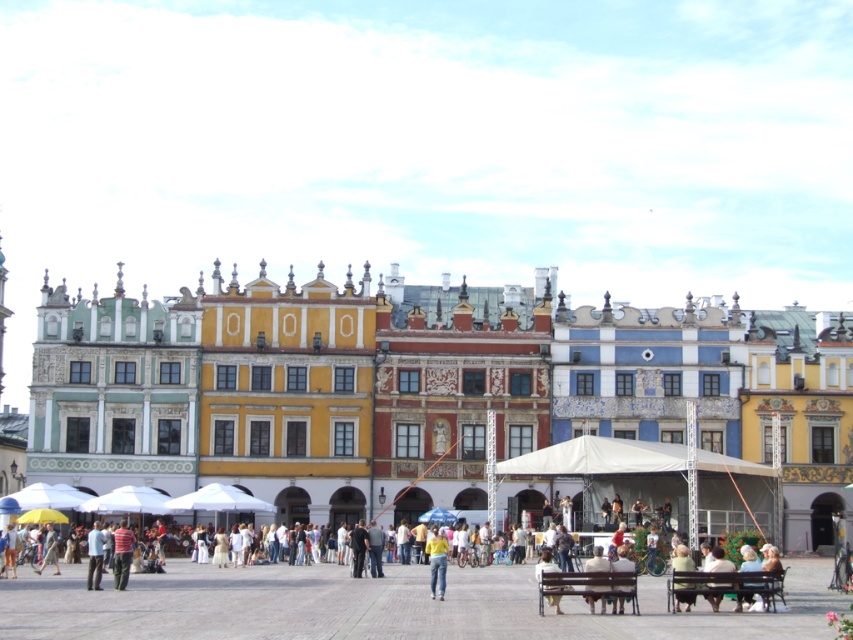
Question: Which of the following is the closest to the observer?

Choices:
 (A) white fabric canopy at center
 (B) white cotton shirt at lower center
 (C) multicolored painted buildings at center

Answer: (B)

Question: Which point is farther to the camera?

Choices:
 (A) (125, 564)
 (B) (782, 614)

Answer: (A)

Question: From the image, what is the correct spatial relationship of multicolored painted buildings at center in relation to striped shirt at lower left?

Choices:
 (A) right
 (B) left

Answer: (A)

Question: Which of the following is the closest to the observer?

Choices:
 (A) (123, 548)
 (B) (630, 465)
 (C) (55, 592)
 (D) (86, 586)

Answer: (A)

Question: From the image, what is the correct spatial relationship of yellow matte shirt at center in relation to striped shirt at lower left?

Choices:
 (A) right
 (B) left

Answer: (A)

Question: Is white cotton shirt at lower center positioned before white fabric canopy at center?

Choices:
 (A) no
 (B) yes

Answer: (B)